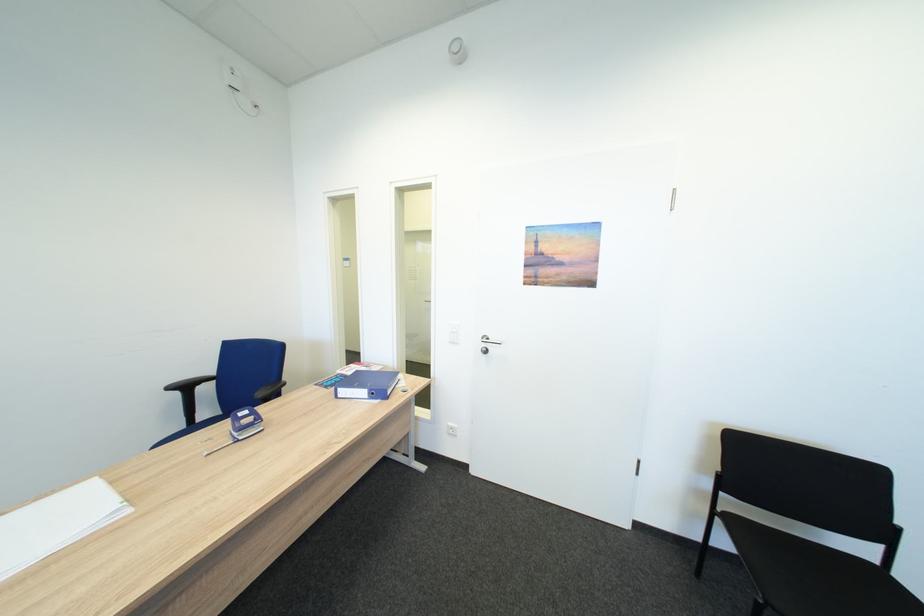
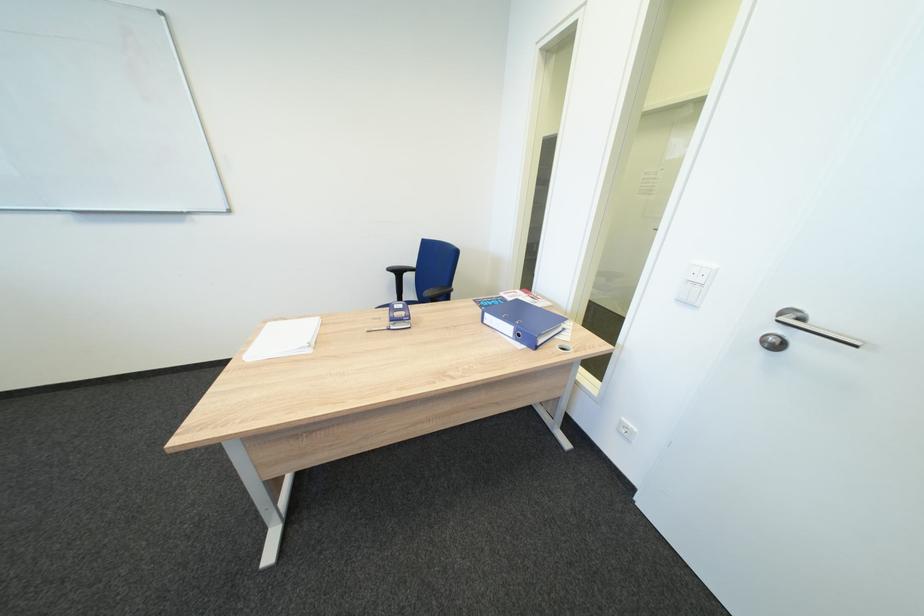
Find the pixel in the second image that matches (250,416) in the first image.

(407, 309)